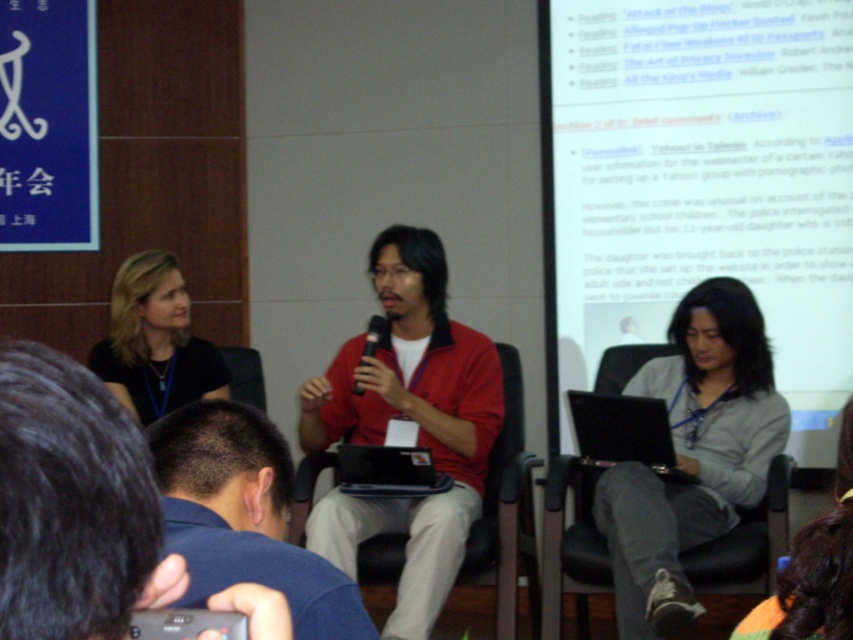
Looking at this image, you are organizing a photo shoot and need to ensure that the dark blue fabric shirt at center and the black plastic laptop at center are both visible in the frame. Given their sizes, which object might require more careful positioning to avoid being obscured?

The dark blue fabric shirt at center is thinner than the black plastic laptop at center, so the shirt might require more careful positioning to avoid being obscured since it is smaller and could be easily hidden behind other objects.

You are an attendee at the conference and want to take a photo of the speaker wearing the dark blue fabric shirt at center. However, there is a person with the black fabric shirt at left blocking your view. Can you move to the right to get a clear shot?

The dark blue fabric shirt at center is to the right of the black fabric shirt at left, so moving to the right of the black fabric shirt at left would position you closer to the dark blue fabric shirt at center, allowing for a clearer view.